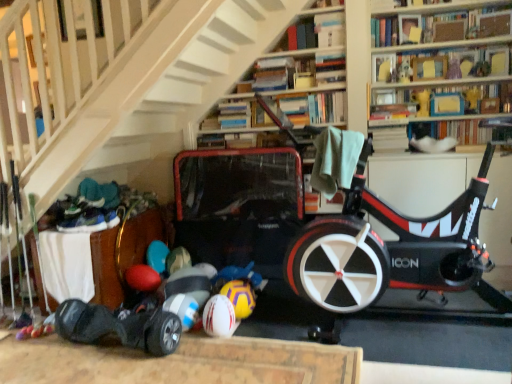
The width and height of the screenshot is (512, 384). In order to click on vacant area that is in front of white matte rugby ball at lower center in this screenshot , I will do `click(215, 350)`.